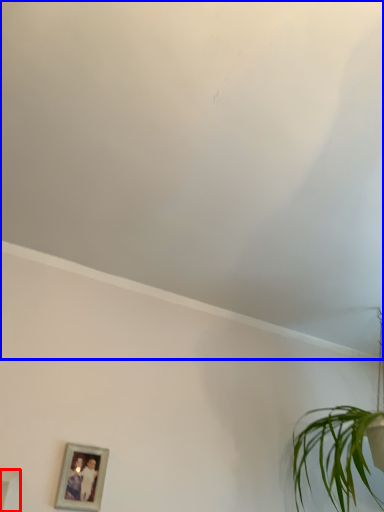
Question: Which object is further to the camera taking this photo, picture frame (highlighted by a red box) or cloud (highlighted by a blue box)?

Choices:
 (A) picture frame
 (B) cloud

Answer: (A)